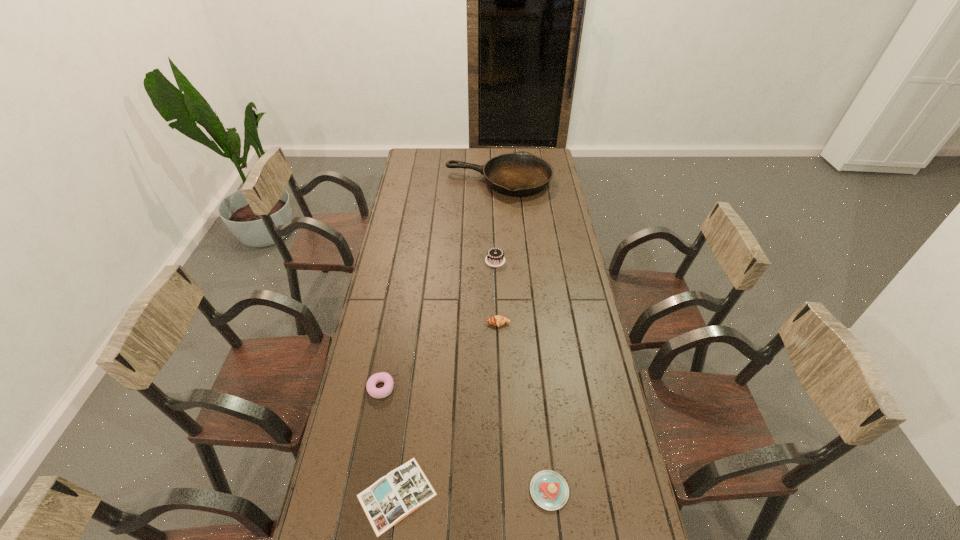
You are a GUI agent. You are given a task and a screenshot of the screen. Output one action in this format:
    pyautogui.click(x=<x>, y=<y>)
    Task: Click on the vacant point located between the farthest object and the nearest pastry
    
    Given the screenshot: What is the action you would take?
    pyautogui.click(x=524, y=336)

You are a GUI agent. You are given a task and a screenshot of the screen. Output one action in this format:
    pyautogui.click(x=<x>, y=<y>)
    Task: Click on the free space between the farthest object and the rightmost pastry
    
    Given the screenshot: What is the action you would take?
    pyautogui.click(x=524, y=336)

Find the location of `vacant point located between the third farthest object and the leftmost pastry`. vacant point located between the third farthest object and the leftmost pastry is located at coordinates (440, 356).

Identify which object is the fourth closest to the fourth farthest object. Please provide its 2D coordinates. Your answer should be formatted as a tuple, i.e. [(x, y)], where the tuple contains the x and y coordinates of a point satisfying the conditions above.

[(495, 257)]

The image size is (960, 540). In order to click on object identified as the fifth closest to the third farthest object in this screenshot , I will do `click(519, 174)`.

You are a GUI agent. You are given a task and a screenshot of the screen. Output one action in this format:
    pyautogui.click(x=<x>, y=<y>)
    Task: Click on the pastry object that ranks as the closest to the farthest object
    
    Given the screenshot: What is the action you would take?
    pyautogui.click(x=497, y=320)

Find the location of `the closest pastry to the fifth nearest object`. the closest pastry to the fifth nearest object is located at coordinates (497, 320).

Image resolution: width=960 pixels, height=540 pixels. I want to click on free point that satisfies the following two spatial constraints: 1. on the back side of the shortest object; 2. on the left side of the farthest object, so click(438, 181).

This screenshot has width=960, height=540. Identify the location of free spot that satisfies the following two spatial constraints: 1. on the front-facing side of the rightmost pastry; 2. on the left side of the third farthest object. (505, 491).